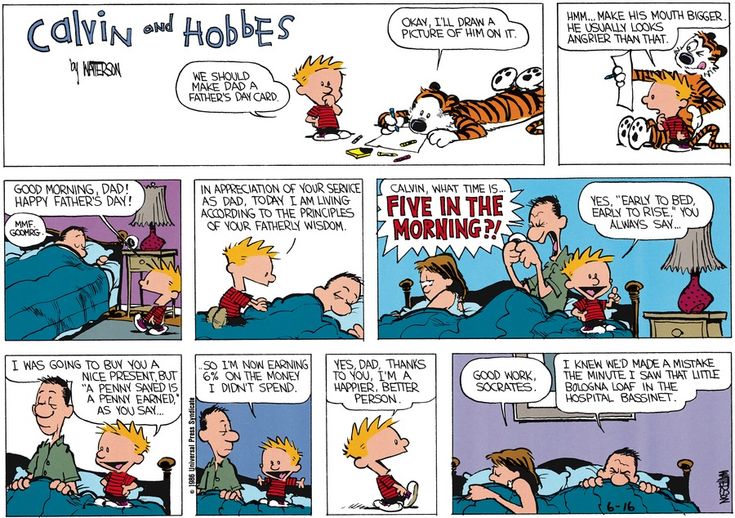
The image size is (735, 518). In order to click on blanket in this screenshot , I will do `click(578, 498)`, `click(207, 506)`, `click(29, 508)`, `click(60, 287)`, `click(278, 325)`, `click(505, 320)`.